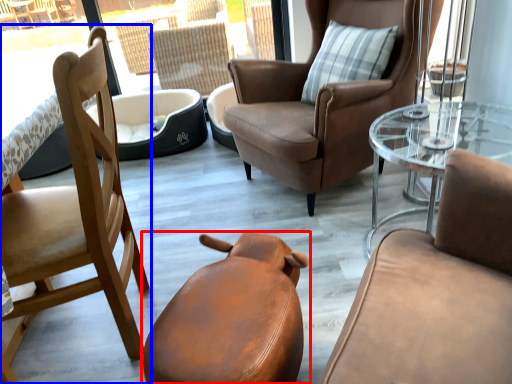
Question: Which of the following is the closest to the observer, chair (highlighted by a red box) or chair (highlighted by a blue box)?

Choices:
 (A) chair
 (B) chair

Answer: (A)